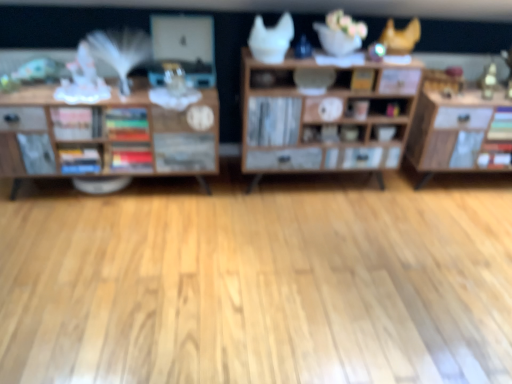
This screenshot has width=512, height=384. What are the coordinates of `free space in front of wooden bookshelf at left, the 1th shelf positioned from the left` in the screenshot? It's located at (106, 259).